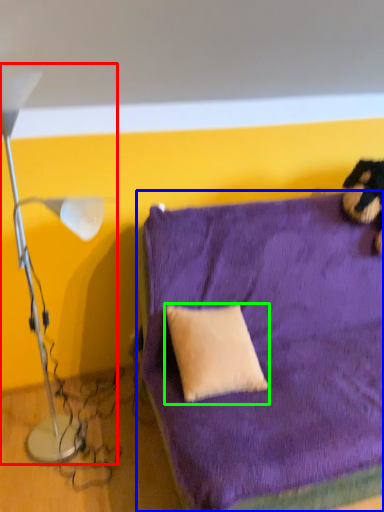
Question: Estimate the real-world distances between objects in this image. Which object is closer to lamp (highlighted by a red box), furniture (highlighted by a blue box) or pillow (highlighted by a green box)?

Choices:
 (A) furniture
 (B) pillow

Answer: (B)